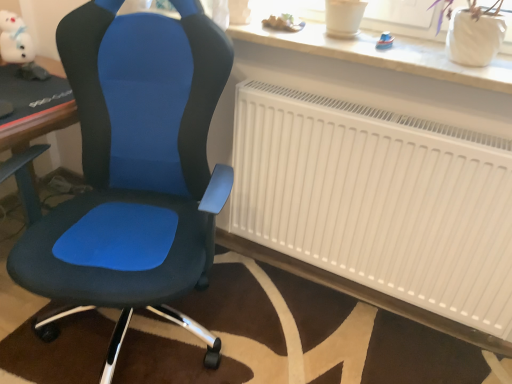
Where is `vacant area to the right of matte blue fabric chair at center`? This screenshot has width=512, height=384. vacant area to the right of matte blue fabric chair at center is located at coordinates (287, 329).